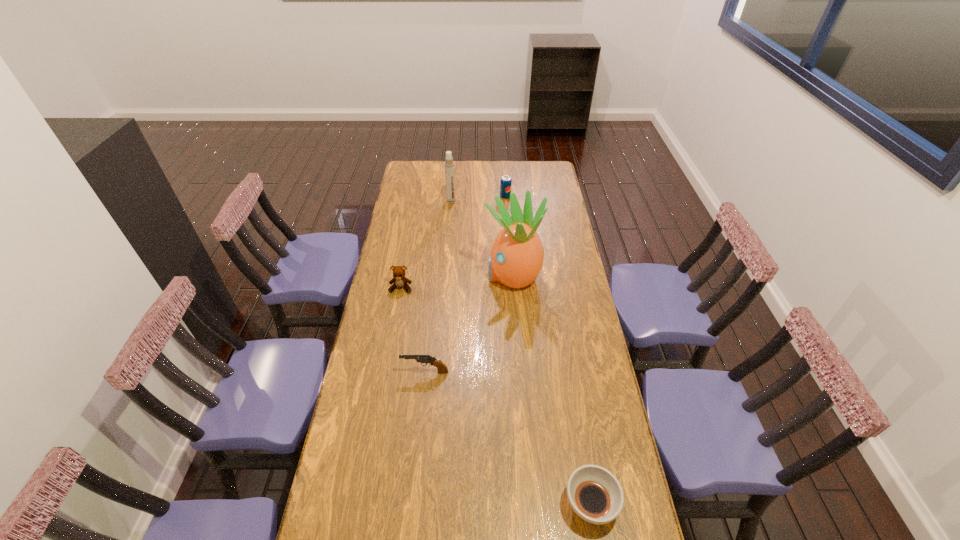
This screenshot has width=960, height=540. I want to click on the tallest object, so click(x=516, y=259).

The image size is (960, 540). I want to click on the fifth shortest object, so click(x=449, y=164).

The image size is (960, 540). What are the coordinates of `teddy bear` in the screenshot? It's located at (399, 280).

At what (x,y) coordinates should I click in order to perform the action: click on pop soda. Please return your answer as a coordinate pair (x, y). The image size is (960, 540). Looking at the image, I should click on (506, 182).

Where is `the second nearest object`? The height and width of the screenshot is (540, 960). the second nearest object is located at coordinates (441, 367).

Image resolution: width=960 pixels, height=540 pixels. I want to click on the nearest object, so click(x=594, y=493).

What are the coordinates of `the shortest object` in the screenshot? It's located at (594, 493).

The image size is (960, 540). I want to click on vacant space located 0.400m at the entrance of the pineapple, so [395, 275].

Where is `free space located at the entrance of the pineapple`? Image resolution: width=960 pixels, height=540 pixels. free space located at the entrance of the pineapple is located at coordinates (430, 275).

Where is `free space located 0.060m at the entrance of the pineapple`? This screenshot has width=960, height=540. free space located 0.060m at the entrance of the pineapple is located at coordinates (470, 275).